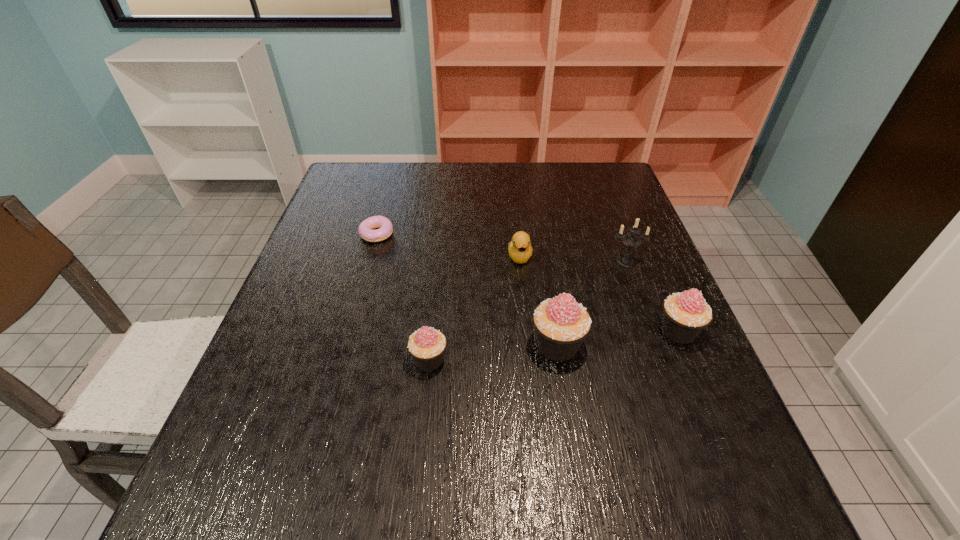
Locate an element on the screen. The width and height of the screenshot is (960, 540). blank space located on the back of the rightmost cupcake is located at coordinates (646, 256).

I want to click on vacant area situated 0.190m on the front of the leftmost object, so click(x=359, y=296).

This screenshot has height=540, width=960. In order to click on vacant point located 0.390m on the back of the candle holder in this screenshot , I will do `click(595, 177)`.

Identify the location of free region located on the face of the second shortest object. coord(528,338).

At what (x,y) coordinates should I click in order to perform the action: click on object present at the left edge. Please return your answer as a coordinate pair (x, y). The width and height of the screenshot is (960, 540). Looking at the image, I should click on (365, 229).

Where is `cupcake that is at the right edge`? The image size is (960, 540). cupcake that is at the right edge is located at coordinates (686, 314).

At what (x,y) coordinates should I click in order to perform the action: click on candle holder present at the right edge. Please return your answer as a coordinate pair (x, y). This screenshot has height=540, width=960. Looking at the image, I should click on (x=631, y=240).

In the image, there is a desktop. Identify the location of vacant space at the far edge. The image size is (960, 540). (533, 188).

In the image, there is a desktop. Identify the location of free space at the near edge. The width and height of the screenshot is (960, 540). (373, 424).

The width and height of the screenshot is (960, 540). I want to click on free region at the left edge, so click(335, 238).